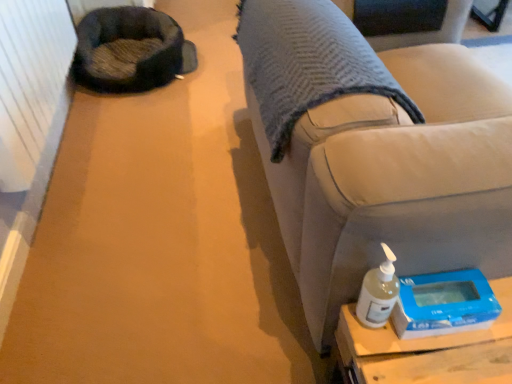
Question: From a real-world perspective, is satin beige couch at lower right positioned over dark gray plush bean bag chair at upper left based on gravity?

Choices:
 (A) yes
 (B) no

Answer: (A)

Question: Is the position of satin beige couch at lower right more distant than that of dark gray plush bean bag chair at upper left?

Choices:
 (A) no
 (B) yes

Answer: (A)

Question: Are satin beige couch at lower right and dark gray plush bean bag chair at upper left far apart?

Choices:
 (A) yes
 (B) no

Answer: (A)

Question: Is satin beige couch at lower right thinner than dark gray plush bean bag chair at upper left?

Choices:
 (A) no
 (B) yes

Answer: (A)

Question: Does satin beige couch at lower right touch dark gray plush bean bag chair at upper left?

Choices:
 (A) no
 (B) yes

Answer: (A)

Question: Looking at the image, does satin beige couch at lower right seem bigger or smaller compared to white matte bottle at lower right?

Choices:
 (A) big
 (B) small

Answer: (A)

Question: Looking at their shapes, would you say satin beige couch at lower right is wider or thinner than white matte bottle at lower right?

Choices:
 (A) thin
 (B) wide

Answer: (B)

Question: From the image's perspective, is satin beige couch at lower right above or below white matte bottle at lower right?

Choices:
 (A) below
 (B) above

Answer: (B)

Question: From a real-world perspective, is satin beige couch at lower right above or below white matte bottle at lower right?

Choices:
 (A) below
 (B) above

Answer: (A)

Question: From a real-world perspective, is satin beige couch at lower right above or below blue plastic scale at lower right?

Choices:
 (A) above
 (B) below

Answer: (B)

Question: From their relative heights in the image, would you say satin beige couch at lower right is taller or shorter than blue plastic scale at lower right?

Choices:
 (A) tall
 (B) short

Answer: (A)

Question: Is point (353, 102) positioned closer to the camera than point (440, 281)?

Choices:
 (A) closer
 (B) farther

Answer: (B)

Question: From the image's perspective, is satin beige couch at lower right located above or below blue plastic scale at lower right?

Choices:
 (A) below
 (B) above

Answer: (B)

Question: Considering the positions of blue plastic scale at lower right and satin beige couch at lower right in the image, is blue plastic scale at lower right wider or thinner than satin beige couch at lower right?

Choices:
 (A) thin
 (B) wide

Answer: (A)

Question: Relative to satin beige couch at lower right, is blue plastic scale at lower right in front or behind?

Choices:
 (A) front
 (B) behind

Answer: (B)